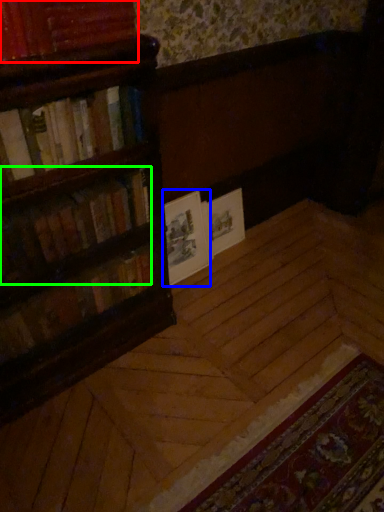
Question: Estimate the real-world distances between objects in this image. Which object is farther from book (highlighted by a red box), paperback book (highlighted by a blue box) or book (highlighted by a green box)?

Choices:
 (A) paperback book
 (B) book

Answer: (A)